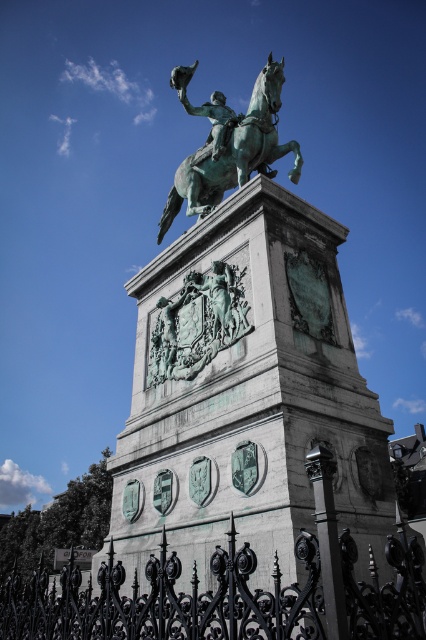
You are standing in front of the statue and want to take a photo of the green patina statue at center. To ensure the entire statue is in frame, where should you position your camera relative to the point at coordinates (245, 372)?

The point at coordinates (245, 372) corresponds to the green patina statue at center, so positioning the camera directly facing this point will ensure the entire statue is captured in the frame.

You are a city planner reviewing the layout of a public square. The square has a coordinate grid system where the bottom left corner is point 0.0,0.0 and the top right corner is 1.0,1.0. You need to place a new information kiosk at point 0.5,0.5. However, there is already a green patina statue at center located at point 0.583,0.577. Is the kiosk placement at 0.5,0.5 feasible without overlapping the statue?

The green patina statue at center is located at point (x=245, y=372), which is close to but not exactly at (x=213, y=320). The coordinates differ by 0.083 in the x and y axes respectively, so placing the kiosk at (x=213, y=320) would not overlap with the statue.